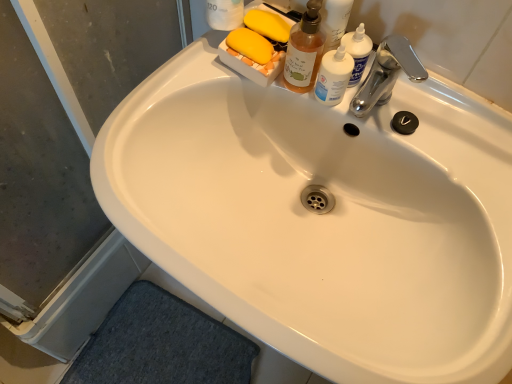
Question: Can you confirm if transparent plastic screen door at lower left is smaller than translucent plastic bottle at upper right?

Choices:
 (A) no
 (B) yes

Answer: (A)

Question: From the image's perspective, does transparent plastic screen door at lower left appear higher than translucent plastic bottle at upper right?

Choices:
 (A) yes
 (B) no

Answer: (B)

Question: Can you confirm if transparent plastic screen door at lower left is wider than translucent plastic bottle at upper right?

Choices:
 (A) yes
 (B) no

Answer: (A)

Question: Considering the relative sizes of transparent plastic screen door at lower left and translucent plastic bottle at upper right in the image provided, is transparent plastic screen door at lower left taller than translucent plastic bottle at upper right?

Choices:
 (A) yes
 (B) no

Answer: (A)

Question: Is translucent plastic bottle at upper right surrounded by transparent plastic screen door at lower left?

Choices:
 (A) yes
 (B) no

Answer: (B)

Question: Can you confirm if transparent plastic screen door at lower left is thinner than translucent plastic bottle at upper right?

Choices:
 (A) no
 (B) yes

Answer: (A)

Question: Is translucent plastic bottle at upper right further to camera compared to translucent amber liquid soap dispenser at upper center?

Choices:
 (A) yes
 (B) no

Answer: (A)

Question: From the image's perspective, is translucent plastic bottle at upper right below translucent amber liquid soap dispenser at upper center?

Choices:
 (A) no
 (B) yes

Answer: (B)

Question: From the image's perspective, does translucent plastic bottle at upper right appear higher than translucent amber liquid soap dispenser at upper center?

Choices:
 (A) no
 (B) yes

Answer: (A)

Question: Is translucent plastic bottle at upper right closer to camera compared to translucent amber liquid soap dispenser at upper center?

Choices:
 (A) no
 (B) yes

Answer: (A)

Question: Can you confirm if translucent plastic bottle at upper right is thinner than translucent amber liquid soap dispenser at upper center?

Choices:
 (A) yes
 (B) no

Answer: (A)

Question: Considering the relative sizes of translucent plastic bottle at upper right and translucent amber liquid soap dispenser at upper center in the image provided, is translucent plastic bottle at upper right bigger than translucent amber liquid soap dispenser at upper center?

Choices:
 (A) yes
 (B) no

Answer: (B)

Question: From the image's perspective, is transparent plastic screen door at lower left on top of translucent amber liquid soap dispenser at upper center?

Choices:
 (A) no
 (B) yes

Answer: (A)